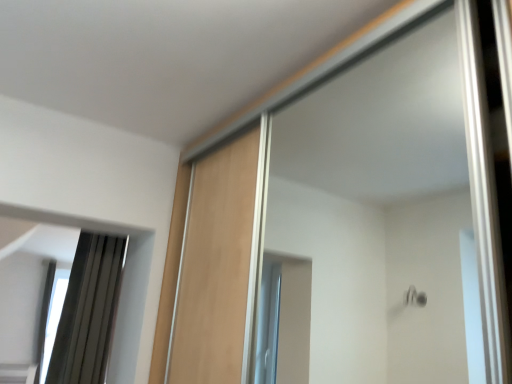
Question: In terms of height, does transparent glass window at lower left look taller or shorter compared to matte gray curtain at left?

Choices:
 (A) short
 (B) tall

Answer: (B)

Question: From the image's perspective, is transparent glass window at lower left located above or below matte gray curtain at left?

Choices:
 (A) below
 (B) above

Answer: (A)

Question: From a real-world perspective, is transparent glass window at lower left above or below matte gray curtain at left?

Choices:
 (A) above
 (B) below

Answer: (B)

Question: Based on their sizes in the image, would you say matte gray curtain at left is bigger or smaller than transparent glass window at lower left?

Choices:
 (A) big
 (B) small

Answer: (B)

Question: Is point (113, 228) closer or farther from the camera than point (52, 301)?

Choices:
 (A) closer
 (B) farther

Answer: (A)

Question: From a real-world perspective, is matte gray curtain at left positioned above or below transparent glass window at lower left?

Choices:
 (A) below
 (B) above

Answer: (B)

Question: From the image's perspective, is matte gray curtain at left above or below transparent glass window at lower left?

Choices:
 (A) below
 (B) above

Answer: (B)